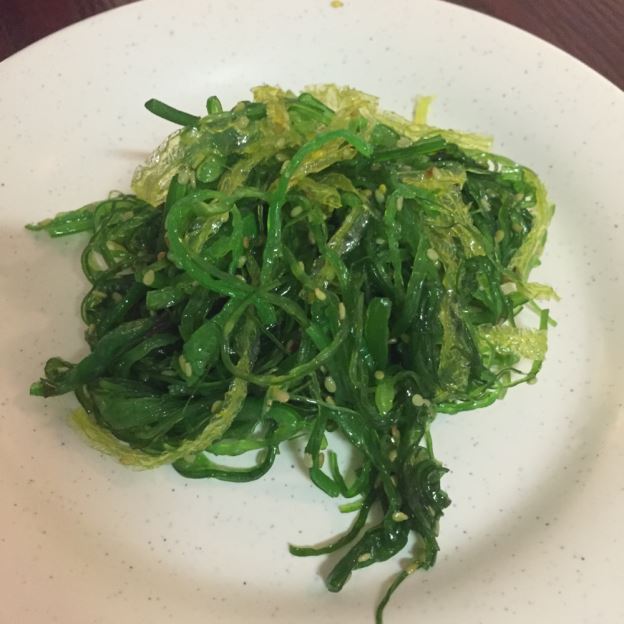
This screenshot has height=624, width=624. What are the coordinates of `wooden table` in the screenshot? It's located at (30, 20).